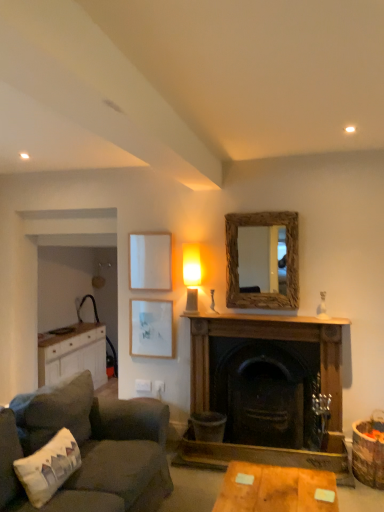
Question: Should I look upward or downward to see white fabric pillow at lower left?

Choices:
 (A) down
 (B) up

Answer: (A)

Question: From a real-world perspective, is wooden fireplace at center over white matte picture frame at upper left, which ranks as the 1th picture frame in top-to-bottom order?

Choices:
 (A) yes
 (B) no

Answer: (B)

Question: Is wooden fireplace at center to the left of white matte picture frame at upper left, which ranks as the 1th picture frame in top-to-bottom order, from the viewer's perspective?

Choices:
 (A) yes
 (B) no

Answer: (B)

Question: Considering the relative positions of wooden fireplace at center and white matte picture frame at upper left, which ranks as the 1th picture frame in top-to-bottom order, in the image provided, is wooden fireplace at center to the right of white matte picture frame at upper left, which ranks as the 1th picture frame in top-to-bottom order, from the viewer's perspective?

Choices:
 (A) no
 (B) yes

Answer: (B)

Question: Would you consider wooden fireplace at center to be distant from white matte picture frame at upper left, the 2th picture frame ordered from the bottom?

Choices:
 (A) yes
 (B) no

Answer: (B)

Question: Is white matte picture frame at upper left, which ranks as the 1th picture frame in top-to-bottom order, located within wooden fireplace at center?

Choices:
 (A) yes
 (B) no

Answer: (B)

Question: Is wooden fireplace at center wider than white matte picture frame at upper left, which ranks as the 1th picture frame in top-to-bottom order?

Choices:
 (A) yes
 (B) no

Answer: (A)

Question: Is white matte picture frame at upper left, which ranks as the 1th picture frame in top-to-bottom order, further to the viewer compared to white wood cabinet at left?

Choices:
 (A) yes
 (B) no

Answer: (B)

Question: Is white matte picture frame at upper left, the 2th picture frame ordered from the bottom, bigger than white wood cabinet at left?

Choices:
 (A) no
 (B) yes

Answer: (A)

Question: Is white matte picture frame at upper left, which ranks as the 1th picture frame in top-to-bottom order, not close to white wood cabinet at left?

Choices:
 (A) no
 (B) yes

Answer: (B)

Question: From a real-world perspective, is white matte picture frame at upper left, the 2th picture frame ordered from the bottom, located higher than white wood cabinet at left?

Choices:
 (A) no
 (B) yes

Answer: (B)

Question: Does white matte picture frame at upper left, which ranks as the 1th picture frame in top-to-bottom order, contain white wood cabinet at left?

Choices:
 (A) yes
 (B) no

Answer: (B)

Question: Is white matte picture frame at upper left, which ranks as the 1th picture frame in top-to-bottom order, positioned beyond the bounds of white wood cabinet at left?

Choices:
 (A) no
 (B) yes

Answer: (B)

Question: From a real-world perspective, is rustic wood mirror at upper center on top of wooden mantelpiece at center?

Choices:
 (A) no
 (B) yes

Answer: (B)